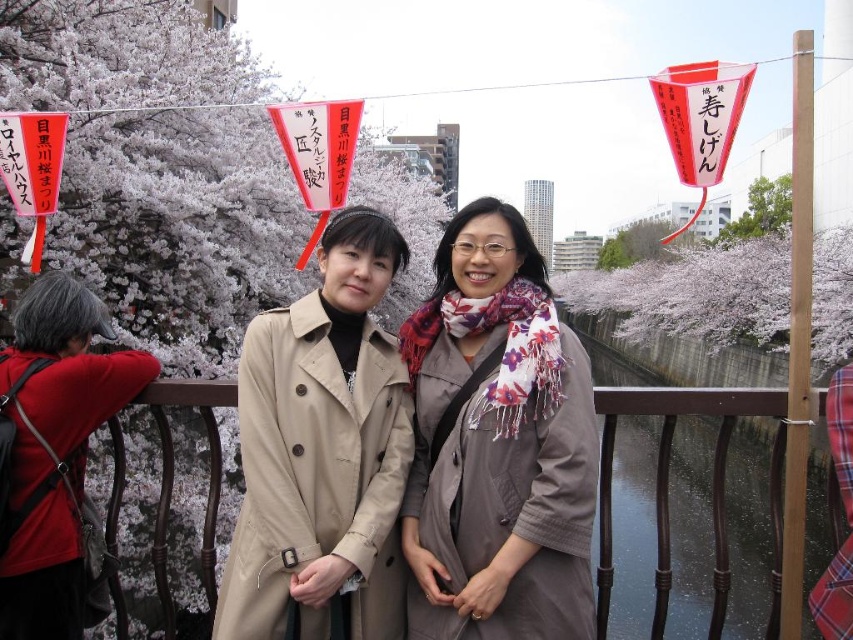
You are a photographer trying to capture the floral scarf at center and the green leafy tree at upper right in the same frame. Which object should you focus on first to ensure both are in focus, considering their sizes?

The floral scarf at center is smaller than the green leafy tree at upper right. To ensure both are in focus, you should focus on the smaller object, the floral scarf at center, as it requires more precise focus due to its size.

You are standing in the cherry blossom viewing spot and want to take a photo of two points marked in the scene. The first point is at coordinates point (564, 330) and the second is at point (383, 349). Which point is closer to you?

Point (564, 330) is closer to the viewer than point (383, 349).

You are a photographer trying to position a red fabric at left in a scene with two people in trench coats. Based on the coordinates given, where should you place the red fabric relative to the people?

The red fabric at left should be placed at the coordinates point (53, 451) relative to the people.